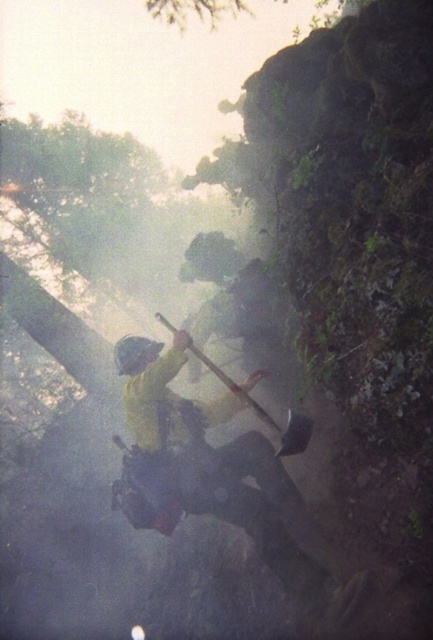
Question: Is yellow matte jacket at center thinner than matte yellow helmet at center?

Choices:
 (A) no
 (B) yes

Answer: (A)

Question: Which point is closer to the camera?

Choices:
 (A) (190, 477)
 (B) (126, 344)

Answer: (A)

Question: Which point is closer to the camera?

Choices:
 (A) (132, 339)
 (B) (142, 362)

Answer: (B)

Question: Can you confirm if yellow matte jacket at center is bigger than matte yellow helmet at center?

Choices:
 (A) yes
 (B) no

Answer: (A)

Question: Does yellow matte jacket at center appear under matte yellow helmet at center?

Choices:
 (A) no
 (B) yes

Answer: (B)